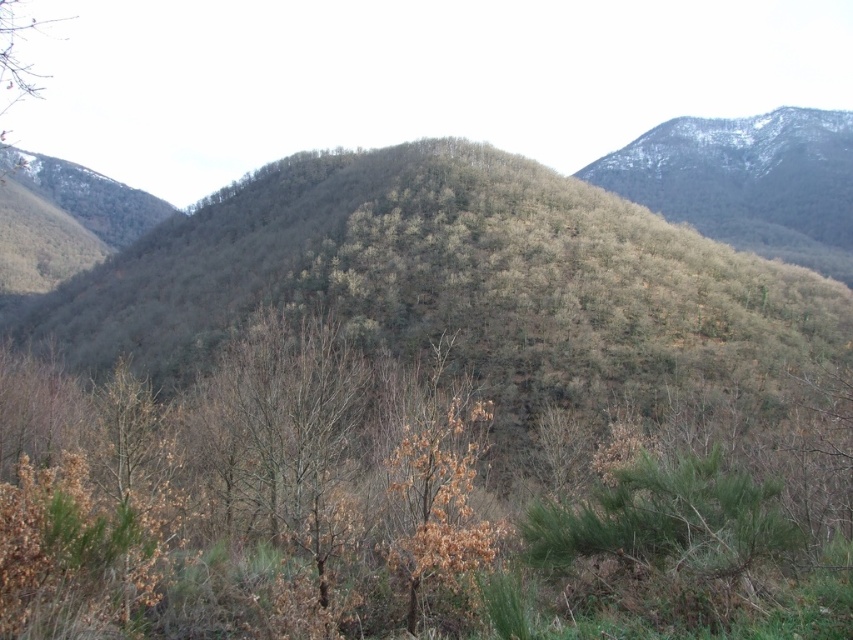
Can you confirm if brown leafy tree at center is smaller than brown leafless tree at upper left?

Yes.

Is brown leafy tree at center shorter than brown leafless tree at upper left?

Yes.

Between point (289, 404) and point (32, 76), which one is positioned in front?

Positioned in front is point (289, 404).

Where is `brown leafy tree at center`? brown leafy tree at center is located at coordinates (247, 497).